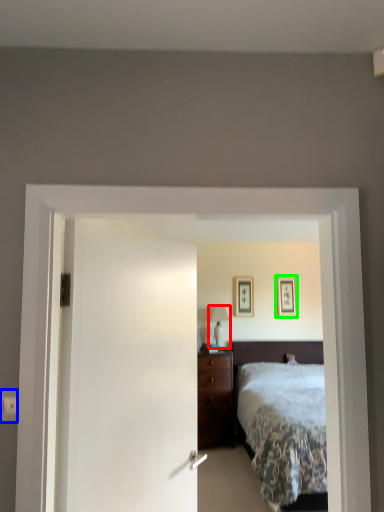
Question: Which object is the farthest from table lamp (highlighted by a red box)? Choose among these: electric outlet (highlighted by a blue box) or picture frame (highlighted by a green box).

Choices:
 (A) electric outlet
 (B) picture frame

Answer: (A)